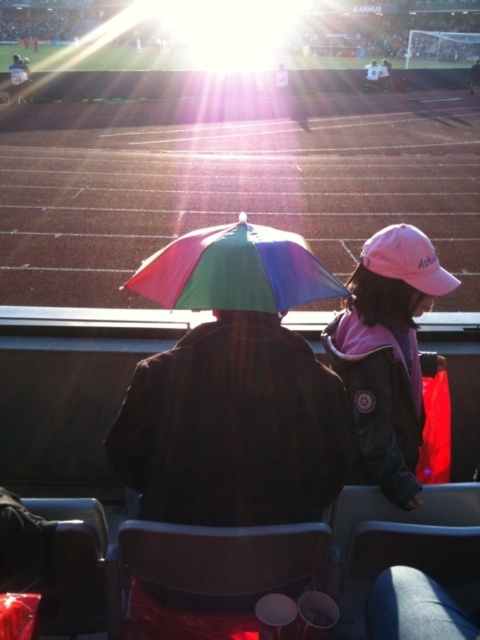
Question: Does rainbow umbrella at center appear over rainbow fabric umbrella at center?

Choices:
 (A) yes
 (B) no

Answer: (B)

Question: Can you confirm if rainbow umbrella at center is positioned above rainbow fabric umbrella at center?

Choices:
 (A) no
 (B) yes

Answer: (A)

Question: Which object is the closest to the rainbow fabric umbrella at center?

Choices:
 (A) pink fabric cap at upper right
 (B) rainbow umbrella at center

Answer: (B)

Question: Is rainbow umbrella at center bigger than matte black jacket at upper left?

Choices:
 (A) yes
 (B) no

Answer: (B)

Question: Which object appears farthest from the camera in this image?

Choices:
 (A) rainbow fabric umbrella at center
 (B) pink fabric cap at upper right

Answer: (B)

Question: Considering the real-world distances, which object is closest to the pink fabric cap at upper right?

Choices:
 (A) matte black jacket at upper left
 (B) rainbow fabric umbrella at center
 (C) rainbow umbrella at center

Answer: (C)